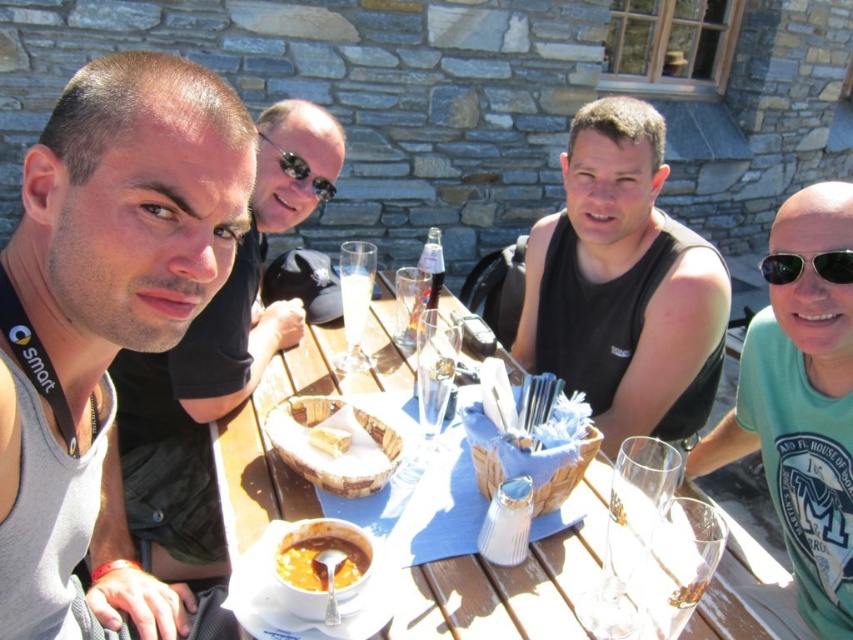
Question: Among these points, which one is farthest from the camera?

Choices:
 (A) (323, 188)
 (B) (772, 260)
 (C) (65, 429)
 (D) (380, 445)

Answer: (A)

Question: Which of these objects is positioned farthest from the breadcrustybasket at center?

Choices:
 (A) sunglasses at center
 (B) black plastic sunglasses at upper right
 (C) wooden table at center
 (D) black matte tank top at center

Answer: (D)

Question: Can you confirm if wooden table at center is positioned to the left of white wooden bread basket at center?

Choices:
 (A) yes
 (B) no

Answer: (B)

Question: Does smooth orange soup at lower center appear over breadcrustybasket at center?

Choices:
 (A) no
 (B) yes

Answer: (A)

Question: Can you confirm if gray fabric tank top at left is positioned above black matte tank top at center?

Choices:
 (A) no
 (B) yes

Answer: (A)

Question: Estimate the real-world distances between objects in this image. Which object is closer to the sunglasses at center?

Choices:
 (A) breadcrustybasket at center
 (B) white wooden bread basket at center
 (C) wooden table at center

Answer: (C)